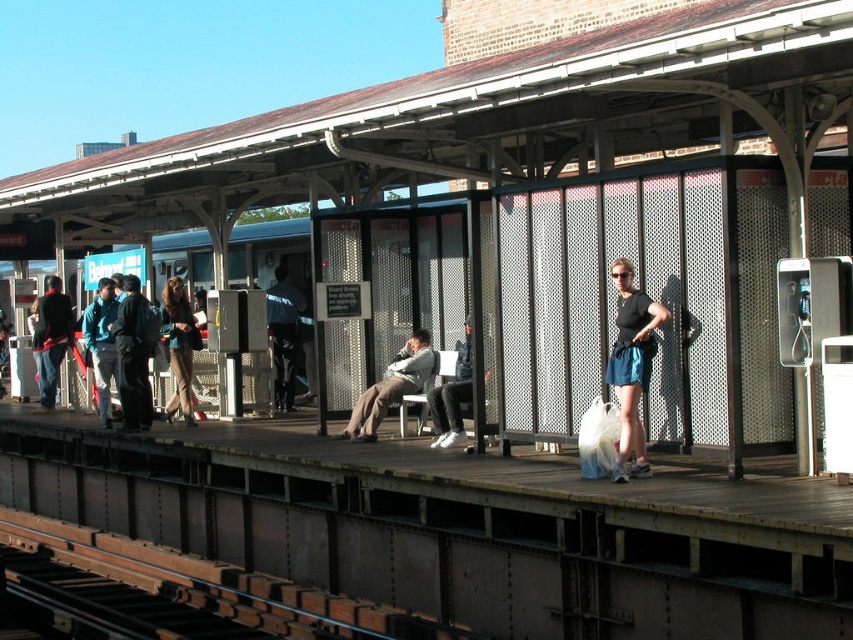
You are a photographer standing on the train station platform. You want to capture a photo of the teal fabric jacket at center and the dark blue jeans at center. Which object should you zoom in on to ensure both are in focus without moving the camera?

The teal fabric jacket at center is smaller than the dark blue jeans at center, so you should zoom in on the teal fabric jacket at center to ensure both are in focus without moving the camera.

Looking at this image, you are standing at point (171, 324) and want to walk to the platform exit located at point (374, 385). Is the exit directly in front of you or behind you?

The point (374, 385) is in front of point (171, 324), so the exit is directly in front of you.

You are waiting for a train at the station and notice two items of clothing at the center of the platform. The teal fabric jacket at center and the dark blue jeans at center. Which one is closer to you?

The teal fabric jacket at center is in front of dark blue jeans at center, so it is closer to you.